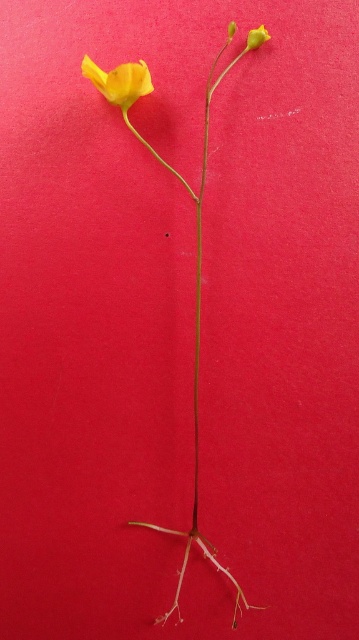
You are an artist trying to paint this plant. You notice two yellow flowers on the plant. One is the yellow matte flower at center and the other is the matte yellow flower at upper left. Which flower should you paint larger in your artwork?

You should paint the yellow matte flower at center larger because its width is larger than the matte yellow flower at upper left.

You are examining a plant specimen in a botanical study. You notice two points marked on the image at coordinates point (84, 58) and point (263, 38). Which of these points is nearer to your line of sight?

Point (84, 58) is closer to the viewer than point (263, 38).

You are an interior designer arranging a bouquet for a client who prefers tall flowers. You have two options in the image, the yellow matte flower at center and the smooth yellow flower at upper center. Which flower should you choose to meet the client preference?

The yellow matte flower at center is much taller than the smooth yellow flower at upper center, so you should choose the yellow matte flower at center to meet the client preference for tall flowers.